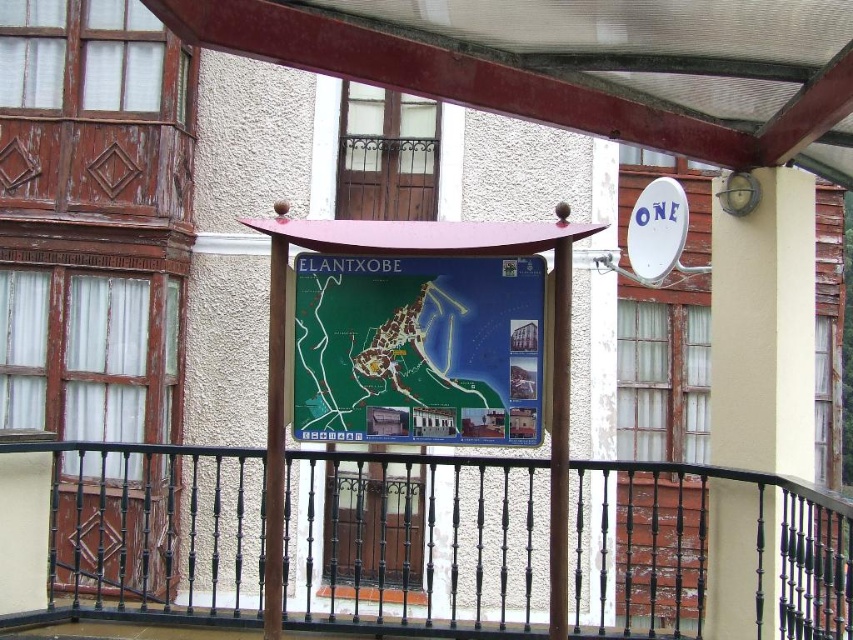
Between point (805, 275) and point (451, 257), which one is positioned in front?

Positioned in front is point (451, 257).

Between point (805, 384) and point (311, 230), which one is positioned behind?

The point (805, 384) is more distant.

You are a GUI agent. You are given a task and a screenshot of the screen. Output one action in this format:
    pyautogui.click(x=<x>, y=<y>)
    Task: Click on the white painted concrete pillar at upper right
    The height and width of the screenshot is (640, 853).
    Given the screenshot: What is the action you would take?
    pyautogui.click(x=764, y=330)

This screenshot has height=640, width=853. Describe the element at coordinates (421, 257) in the screenshot. I see `wooden map at center` at that location.

Does wooden map at center appear under wooden pole at center?

Actually, wooden map at center is above wooden pole at center.

Does point (567, 209) come behind point (560, 548)?

Yes, it is.

Where is `wooden map at center`? This screenshot has height=640, width=853. wooden map at center is located at coordinates (421, 257).

Is green map at center below wooden pole at center?

Incorrect, green map at center is not positioned below wooden pole at center.

Is green map at center to the left of wooden pole at center from the viewer's perspective?

Indeed, green map at center is positioned on the left side of wooden pole at center.

The height and width of the screenshot is (640, 853). Describe the element at coordinates (418, 349) in the screenshot. I see `green map at center` at that location.

Where is `green map at center`? This screenshot has width=853, height=640. green map at center is located at coordinates (418, 349).